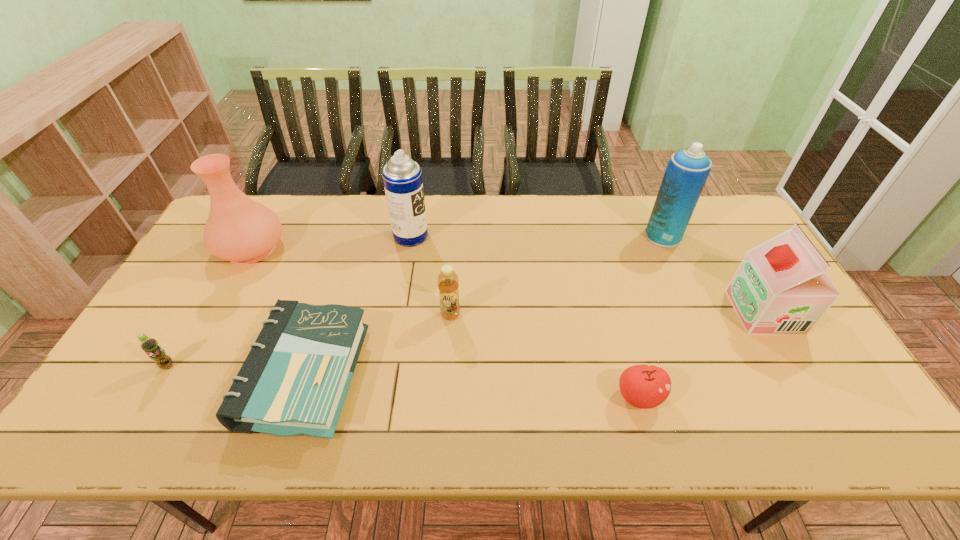
Where is `vacant space at the far left corner`? vacant space at the far left corner is located at coordinates (271, 201).

The width and height of the screenshot is (960, 540). I want to click on free spot between the sixth object from left to right and the vase, so click(445, 322).

Where is `vacant area that lies between the soya milk and the vase`? The image size is (960, 540). vacant area that lies between the soya milk and the vase is located at coordinates (508, 280).

At what (x,y) coordinates should I click in order to perform the action: click on free area in between the right aerosol can and the shortest object. Please return your answer as a coordinate pair (x, y). Looking at the image, I should click on (485, 305).

Identify the location of free spot between the seventh object from left to right and the third object from right to left. (651, 316).

Find the location of a particular element. vacant space that is in between the seventh object from left to right and the third object from right to left is located at coordinates (651, 316).

The width and height of the screenshot is (960, 540). I want to click on free space between the apple and the fifth shortest object, so click(x=702, y=354).

The width and height of the screenshot is (960, 540). I want to click on unoccupied area between the right aerosol can and the shortest object, so click(485, 305).

Find the location of a particular element. This screenshot has width=960, height=540. empty location between the soya milk and the apple is located at coordinates (702, 354).

This screenshot has height=540, width=960. Identify the location of unoccupied position between the apple and the fourth object from left to right. (525, 316).